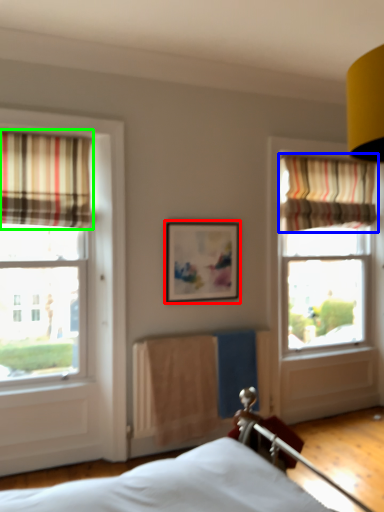
Question: Which object is positioned closest to picture frame (highlighted by a red box)? Select from curtain (highlighted by a blue box) and curtain (highlighted by a green box).

Choices:
 (A) curtain
 (B) curtain

Answer: (B)